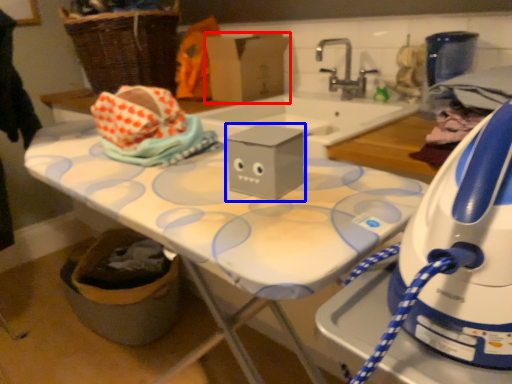
Question: Among these objects, which one is nearest to the camera, cardboard box (highlighted by a red box) or box (highlighted by a blue box)?

Choices:
 (A) cardboard box
 (B) box

Answer: (B)